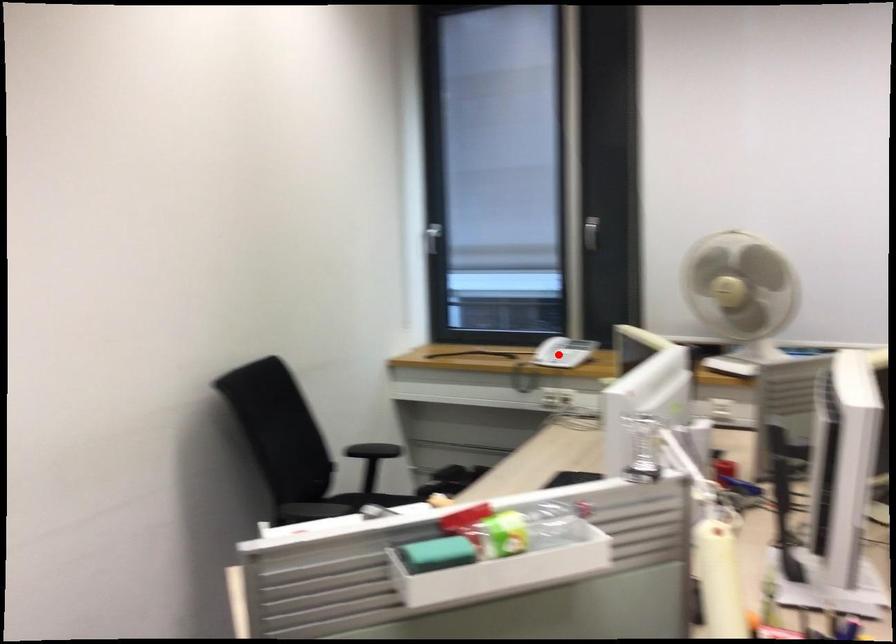
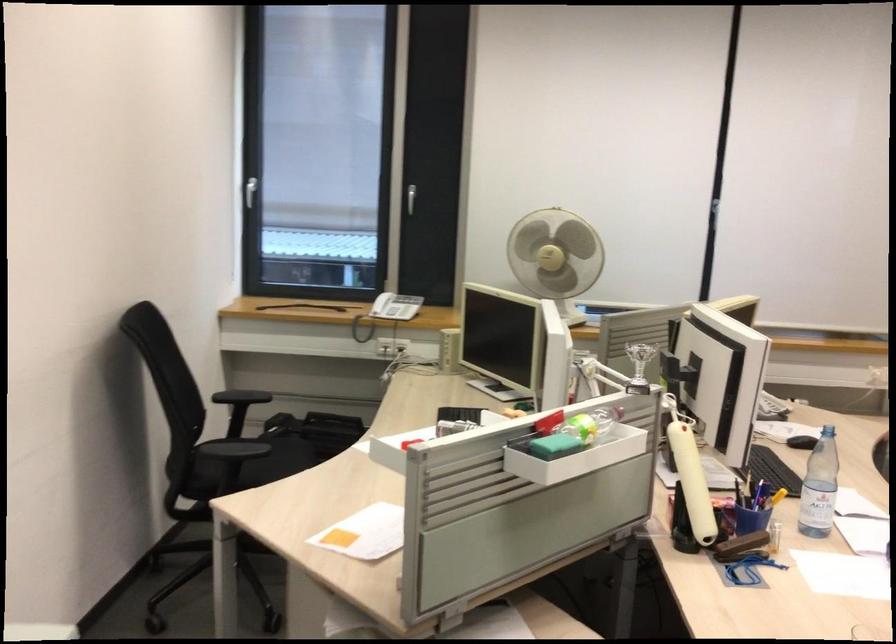
Question: I am providing you with two images of the same scene from different viewpoints. A red point is shown in image1. For the corresponding object point in image2, is it positioned nearer or farther from the camera?

Choices:
 (A) Nearer
 (B) Farther

Answer: (B)